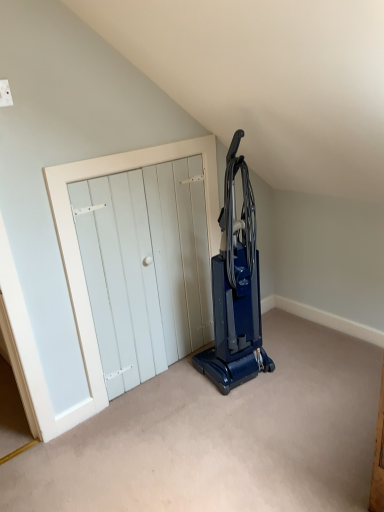
Where is `free spot in front of white wooden door at center`? The width and height of the screenshot is (384, 512). free spot in front of white wooden door at center is located at coordinates (175, 429).